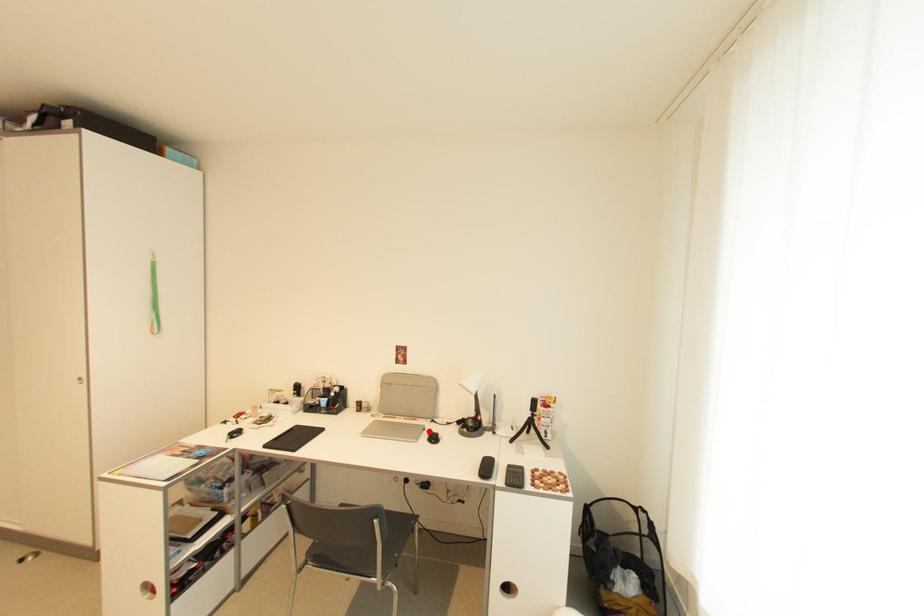
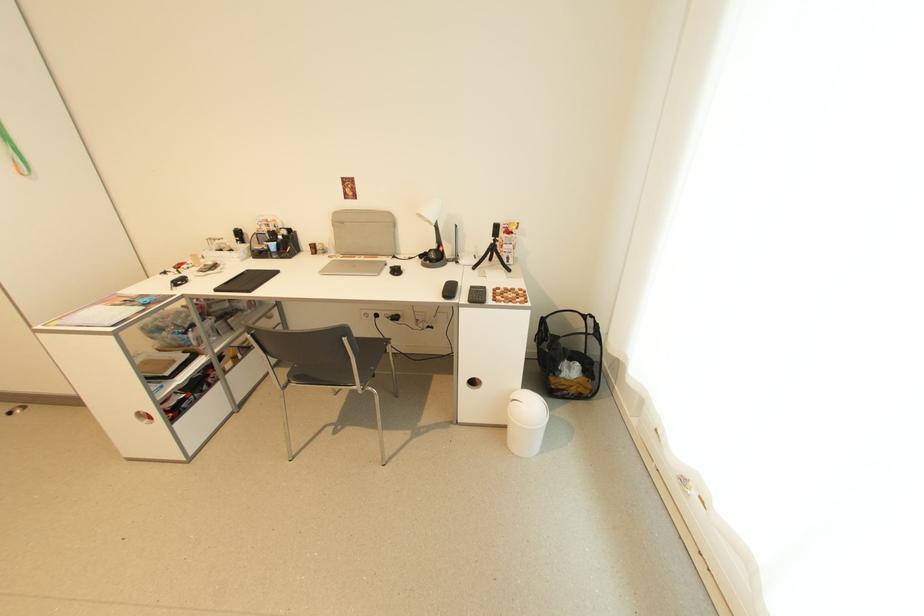
The point at the highlighted location is marked in the first image. Where is the corresponding point in the second image?

(391, 265)